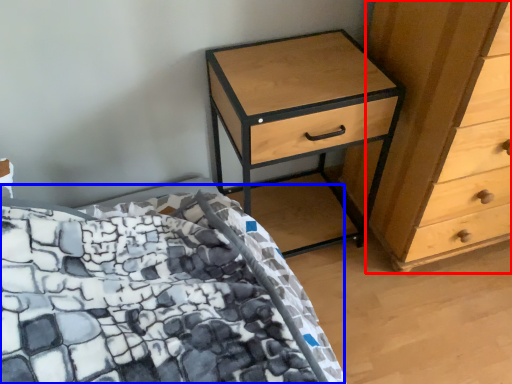
Question: Which point is further to the camera, chest of drawers (highlighted by a red box) or bed (highlighted by a blue box)?

Choices:
 (A) chest of drawers
 (B) bed

Answer: (B)